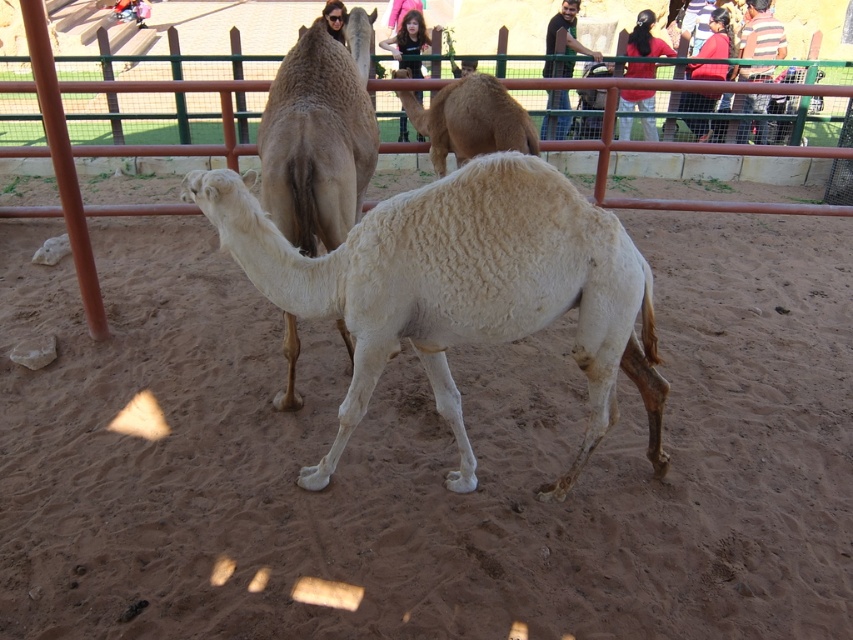
Question: Is white woolen camel at center wider than fuzzy white camel at center?

Choices:
 (A) no
 (B) yes

Answer: (B)

Question: Is the position of white woolen camel at center less distant than that of fuzzy white camel at center?

Choices:
 (A) yes
 (B) no

Answer: (A)

Question: Which object appears closest to the camera in this image?

Choices:
 (A) brown sandy dirt at center
 (B) brown woolen camel at center
 (C) white woolen camel at center
 (D) fuzzy white camel at center

Answer: (A)

Question: Is fuzzy white camel at center above brown metal fence at center?

Choices:
 (A) no
 (B) yes

Answer: (A)

Question: Estimate the real-world distances between objects in this image. Which object is farther from the white woolen camel at center?

Choices:
 (A) fuzzy white camel at center
 (B) brown metal fence at center

Answer: (B)

Question: Which object is the closest to the fuzzy white camel at center?

Choices:
 (A) brown metal fence at center
 (B) white woolen camel at center

Answer: (B)